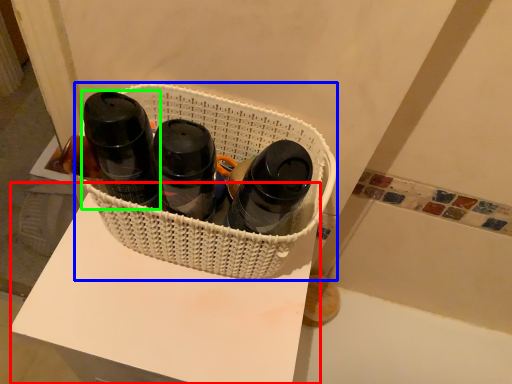
Question: Which is farther away from table (highlighted by a red box)? basket (highlighted by a blue box) or bottle (highlighted by a green box)?

Choices:
 (A) basket
 (B) bottle

Answer: (B)